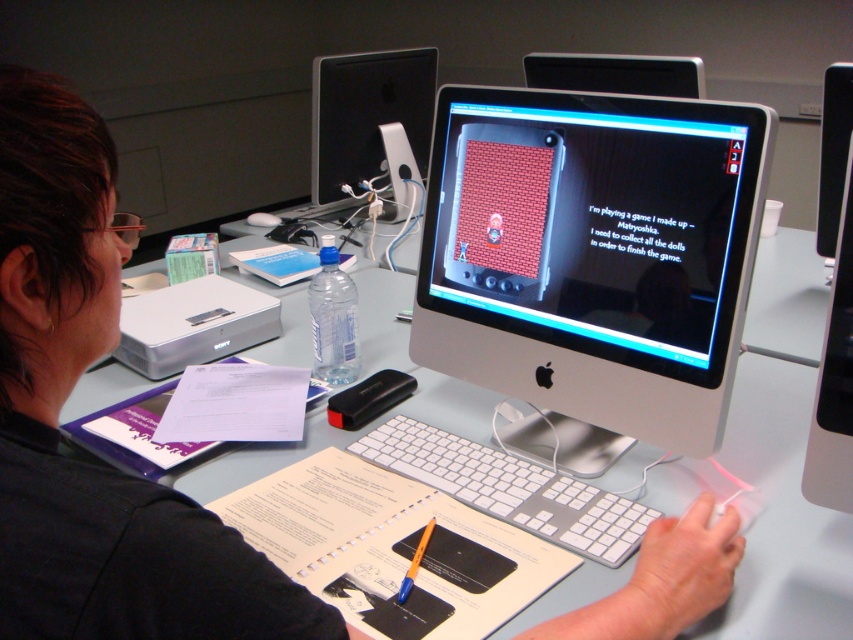
Consider the image. Looking at the desk, which monitor is positioned to the left between the satin black monitor at upper center and the black glossy monitor at upper center?

The satin black monitor at upper center is positioned to the left of the black glossy monitor at upper center.

You are setting up a dual monitor system for a graphic designer who prefers the taller monitor to be on the left side. Given the current arrangement, will you need to adjust the position of the satin black monitor at upper center and black glossy monitor at upper center?

The satin black monitor at upper center is taller than the black glossy monitor at upper center. Since the graphic designer prefers the taller monitor on the left side, you will need to adjust their positions to meet this requirement.